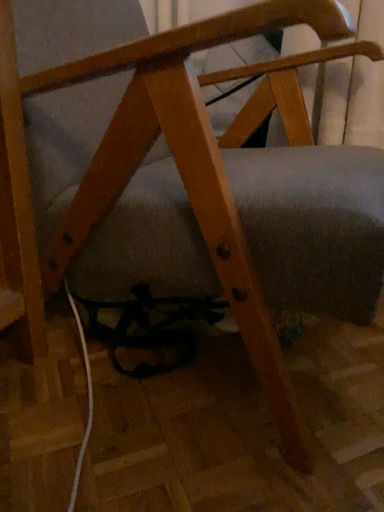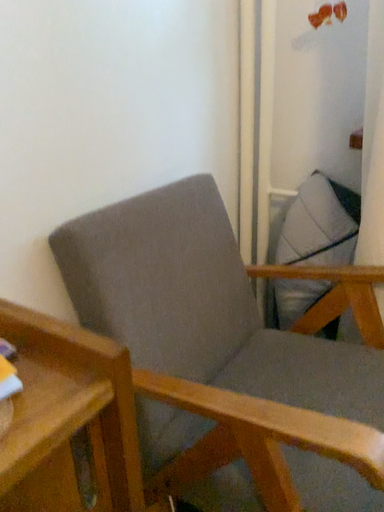
Question: How did the camera likely rotate when shooting the video?

Choices:
 (A) rotated right
 (B) rotated left

Answer: (B)